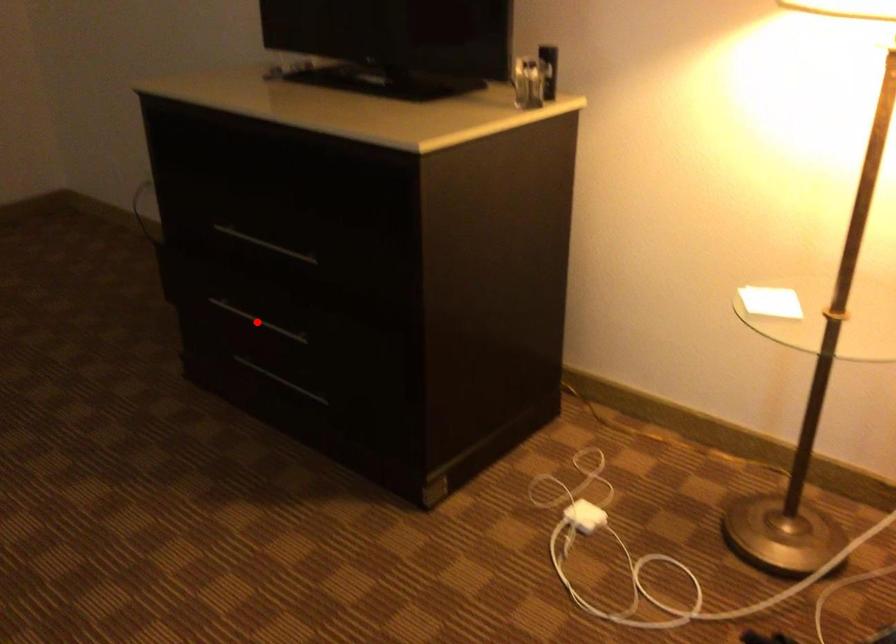
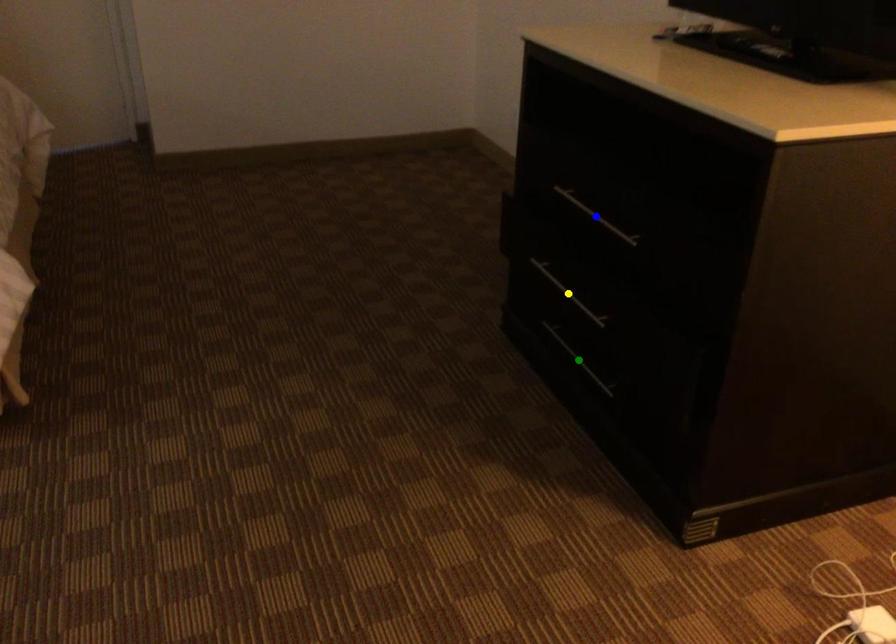
Question: I am providing you with two images of the same scene from different viewpoints. A red point is marked on the first image. You are given multiple points on the second image. Can you choose the point in image 2 that corresponds to the point in image 1?

Choices:
 (A) blue point
 (B) green point
 (C) yellow point

Answer: (C)